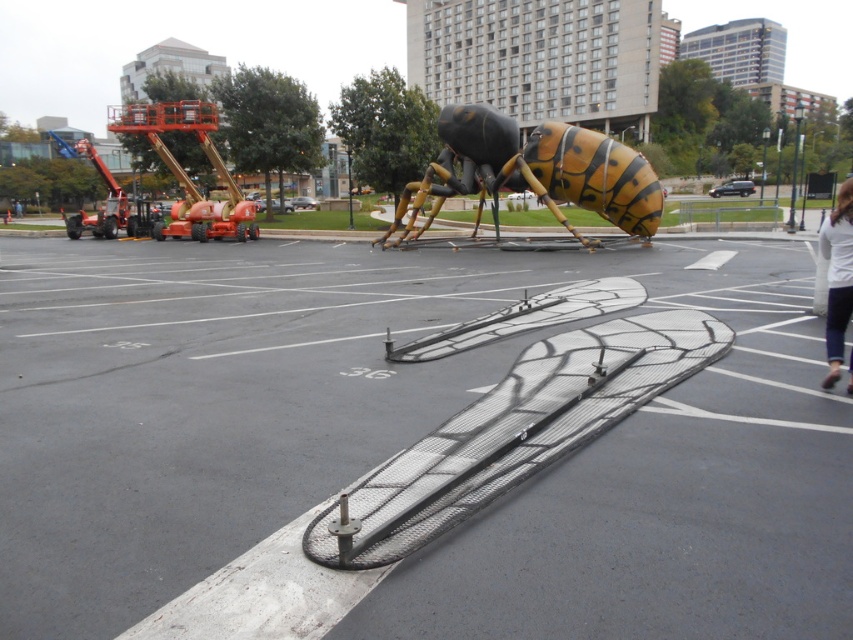
Question: From the image, what is the correct spatial relationship of metallic gray parking lot at center in relation to yellow/black striped insect at center?

Choices:
 (A) left
 (B) right

Answer: (A)

Question: Does metallic gray parking lot at center appear on the left side of yellow/black striped insect at center?

Choices:
 (A) no
 (B) yes

Answer: (B)

Question: Does metallic gray parking lot at center have a lesser width compared to yellow/black striped insect at center?

Choices:
 (A) yes
 (B) no

Answer: (B)

Question: Which object appears farthest from the camera in this image?

Choices:
 (A) metallic gray parking lot at center
 (B) yellow/black striped insect at center

Answer: (B)

Question: Which of the following is the closest to the observer?

Choices:
 (A) yellow/black striped insect at center
 (B) metallic gray parking lot at center

Answer: (B)